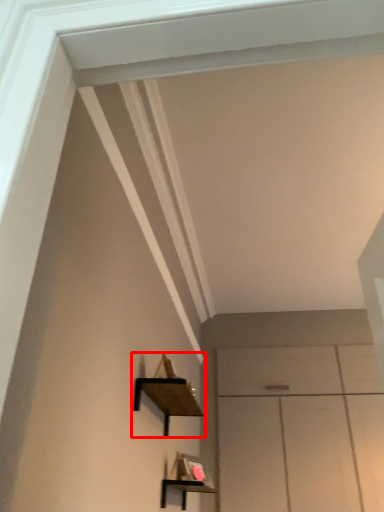
Question: Observing the image, what is the correct spatial positioning of shelf (annotated by the red box) in reference to shelf?

Choices:
 (A) left
 (B) right

Answer: (A)